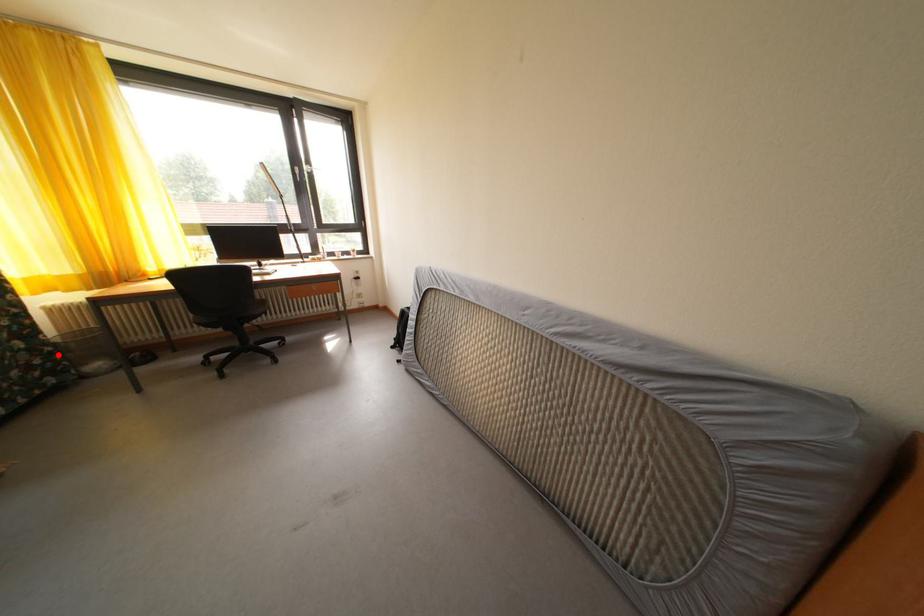
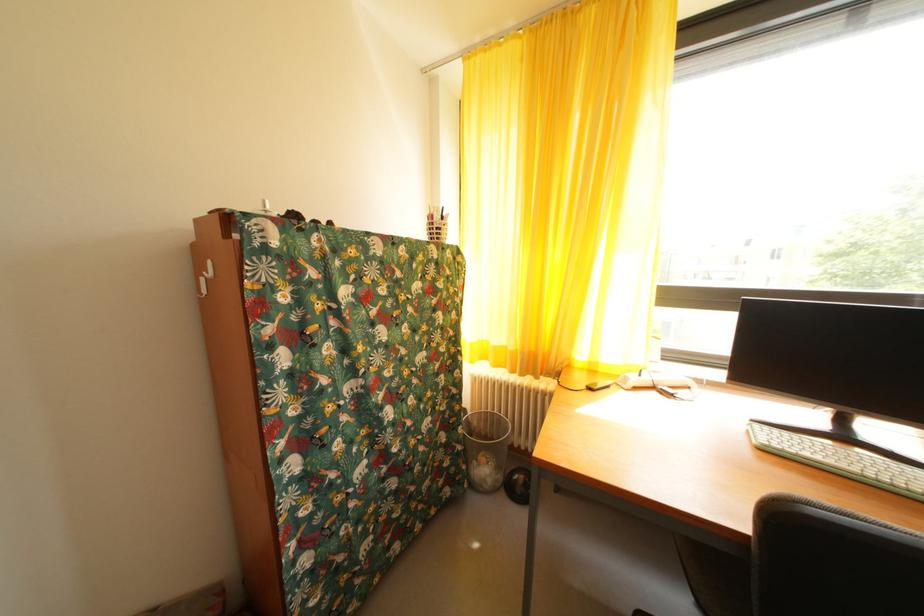
Where in the second image is the point corresponding to the highlighted location from the first image?

(468, 454)